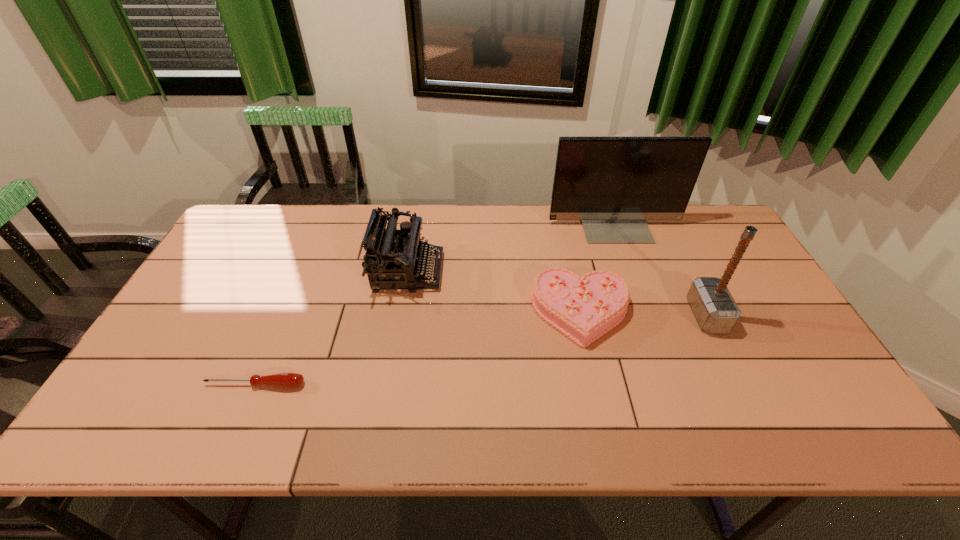
Locate an element on the screen. The image size is (960, 540). computer monitor is located at coordinates (613, 185).

Locate an element on the screen. Image resolution: width=960 pixels, height=540 pixels. hammer is located at coordinates (716, 311).

Find the location of `typewriter`. typewriter is located at coordinates (393, 258).

I want to click on the second object from left to right, so click(x=393, y=258).

What are the coordinates of `cake` in the screenshot? It's located at (583, 309).

This screenshot has width=960, height=540. Find the location of `the leftmost object`. the leftmost object is located at coordinates (282, 380).

Identify the location of screwdriver. (282, 380).

This screenshot has height=540, width=960. Find the location of `vacant space situated on the screen of the computer monitor`. vacant space situated on the screen of the computer monitor is located at coordinates (636, 285).

I want to click on vacant area situated on the striking surface of the hammer, so click(x=660, y=315).

Find the location of a particular element. free space located on the striking surface of the hammer is located at coordinates (623, 315).